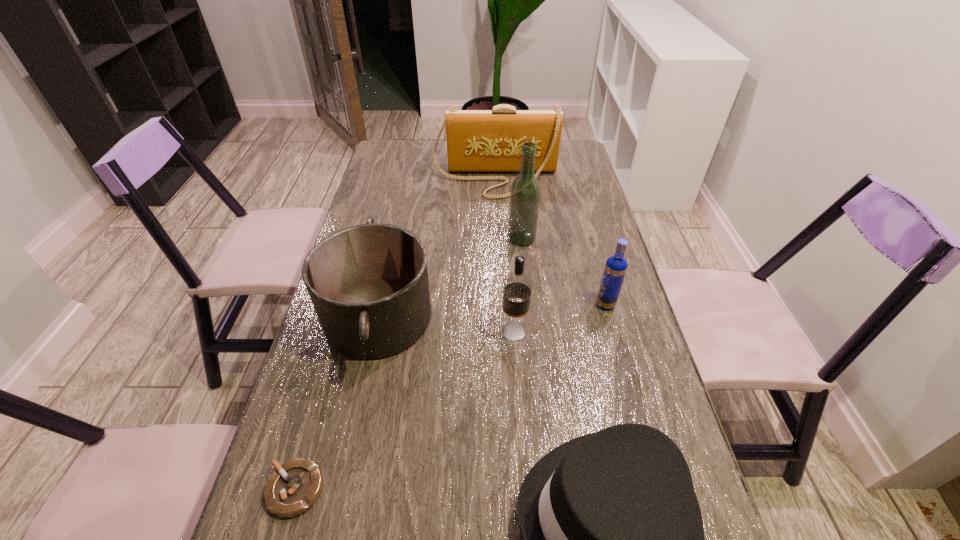
You are a GUI agent. You are given a task and a screenshot of the screen. Output one action in this format:
    pyautogui.click(x=<x>, y=<y>)
    Task: Click on the object identified as the second closest to the nearer vodka
    This screenshot has width=960, height=540.
    Given the screenshot: What is the action you would take?
    pyautogui.click(x=615, y=269)

Where is `object that is the closest to the nearer vodka`? object that is the closest to the nearer vodka is located at coordinates (369, 286).

What are the coordinates of `vacant area that satisfies the following two spatial constraints: 1. on the decorative side of the liquor; 2. on the left side of the handbag` in the screenshot? It's located at (497, 239).